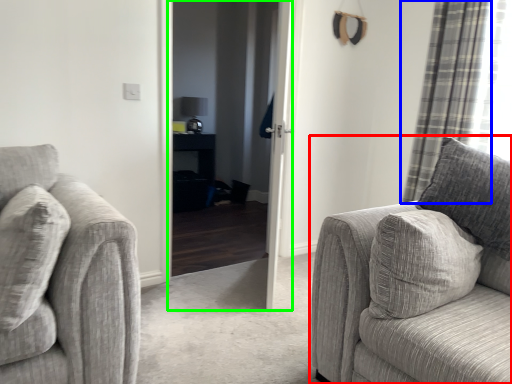
Question: Which object is the farthest from studio couch (highlighted by a red box)? Choose among these: curtain (highlighted by a blue box) or screen door (highlighted by a green box).

Choices:
 (A) curtain
 (B) screen door

Answer: (B)